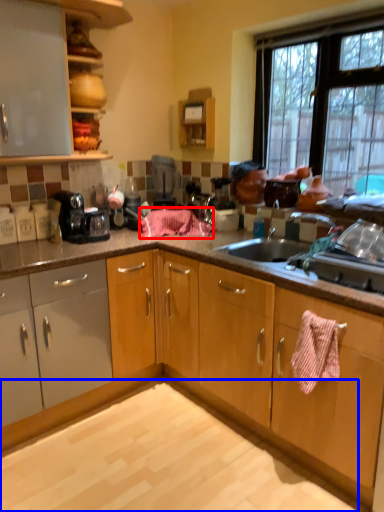
Question: Which object appears closest to the camera in this image, blanket (highlighted by a red box) or granite (highlighted by a blue box)?

Choices:
 (A) blanket
 (B) granite

Answer: (B)